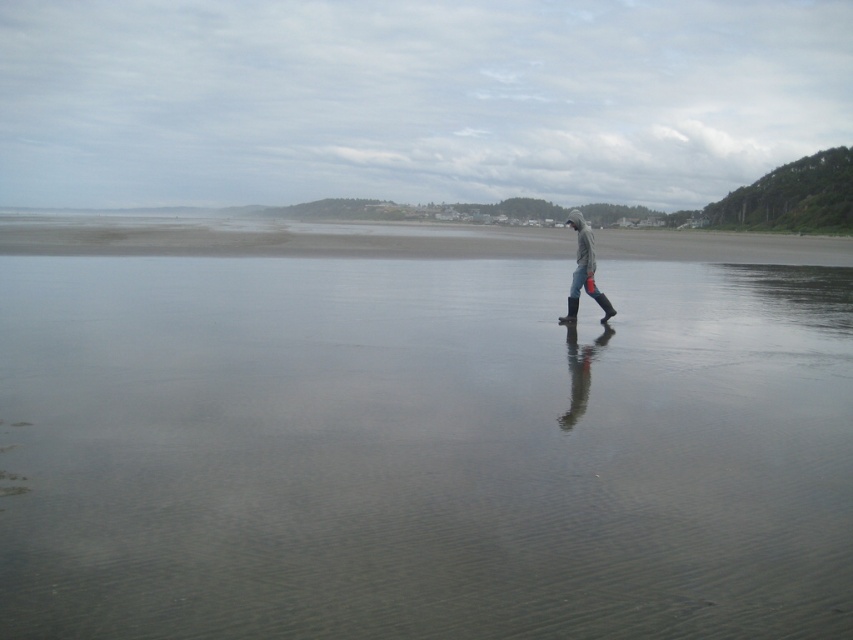
You are standing on the smooth sand beach at center and want to place your gray rubber boots at center in front of you. Based on their heights, will the boots be fully visible from your current position?

The smooth sand beach at center is taller than gray rubber boots at center, so placing the boots in front of you on the beach would result in them being partially obscured by the higher elevation of the sand beach. Only the top part of the boots would remain visible.

You are standing on the smooth sand beach at center and want to walk to the distant village in the background. If your walking speed is 1.5 meters per second, how many minutes will it take you to reach the village?

The distance between you and the village is 10.86 meters. At a walking speed of 1.5 meters per second, it would take approximately 7.24 seconds, which is about 0.12 minutes. However, since the village is in the background, it might be farther away than the given distance. Please check the actual distance before proceeding.

You are standing on the beach and see the clear water at center and the gray rubber boots at center. Which object is closer to the left side of the scene?

The clear water at center is to the left of gray rubber boots at center, so the clear water at center is closer to the left side of the scene.